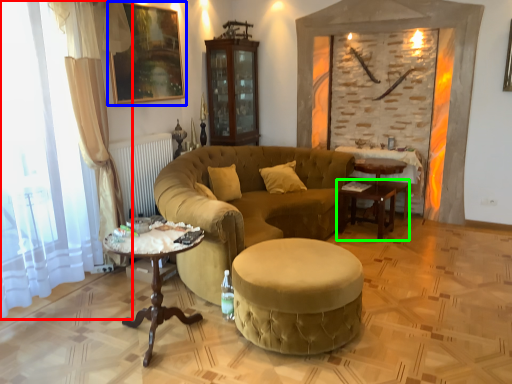
Question: Which is nearer to the curtain (highlighted by a red box)? picture frame (highlighted by a blue box) or table (highlighted by a green box).

Choices:
 (A) picture frame
 (B) table

Answer: (A)